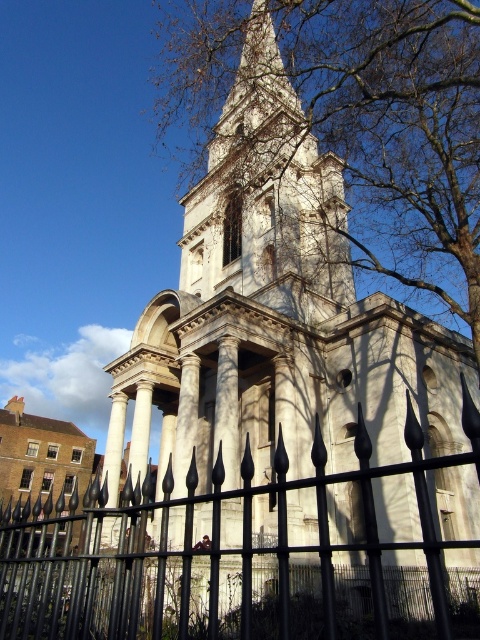
You are standing in front of the church and notice two specific points marked on the image. The first point is at coordinates point (x=340, y=131), and the second is at point (x=369, y=572). Which of these points is closer to you?

Point (x=340, y=131) is closer to you because it is further to the viewer than point (x=369, y=572).

You are standing in front of the church and want to take a photo of the white stone bell tower at upper center without the black wrought iron fence at lower left blocking the view. Which direction should you move to achieve this?

Move to the right side of the black wrought iron fence at lower left so that the white stone bell tower at upper center is no longer blocked by the fence.

You are a drone operator who needs to fly a drone from the black wrought iron fence at lower left to the white stone bell tower at upper center. Given that your drone has a maximum flight distance of 40 meters, will it be able to reach the tower without recharging?

The black wrought iron fence at lower left and white stone bell tower at upper center are 43.64 meters apart from each other. Since the drone can only fly 40 meters before needing to recharge, it will not be able to reach the tower without recharging.